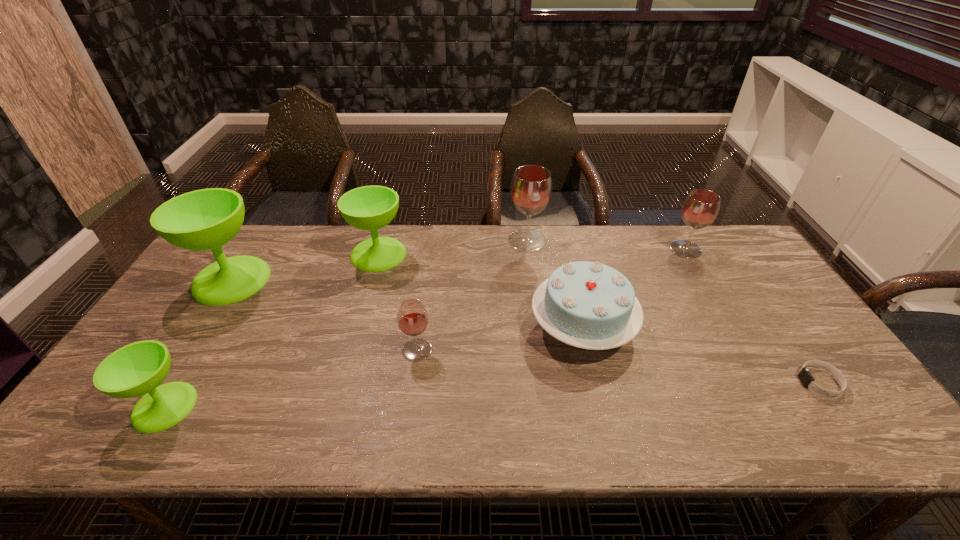
Where is `blank region between the fifth wineglass from left to right and the second smallest green wineglass`? blank region between the fifth wineglass from left to right and the second smallest green wineglass is located at coordinates (453, 247).

The width and height of the screenshot is (960, 540). In order to click on empty location between the birthday cake and the wristband in this screenshot , I will do `click(701, 354)`.

You are a GUI agent. You are given a task and a screenshot of the screen. Output one action in this format:
    pyautogui.click(x=<x>, y=<y>)
    Task: Click on the object that is the sixth closest to the shortest object
    
    Given the screenshot: What is the action you would take?
    pyautogui.click(x=139, y=368)

Locate which object ranks fourth in proximity to the third wineglass from right to left. Please provide its 2D coordinates. Your answer should be formatted as a tuple, i.e. [(x, y)], where the tuple contains the x and y coordinates of a point satisfying the conditions above.

[(139, 368)]

Locate an element on the screen. The width and height of the screenshot is (960, 540). the sixth closest wineglass to the rightmost object is located at coordinates (x=206, y=219).

The height and width of the screenshot is (540, 960). I want to click on wineglass that is the second closest to the nearest green wineglass, so click(x=412, y=317).

I want to click on red wineglass that is the closest to the biggest green wineglass, so click(x=412, y=317).

Locate an element on the screen. Image resolution: width=960 pixels, height=540 pixels. red wineglass identified as the second closest to the fourth object from left to right is located at coordinates (701, 207).

In order to click on green wineglass that stands as the third closest to the shortest object in this screenshot , I will do `click(206, 219)`.

Identify which green wineglass is located as the second nearest to the biggest green wineglass. Please provide its 2D coordinates. Your answer should be formatted as a tuple, i.e. [(x, y)], where the tuple contains the x and y coordinates of a point satisfying the conditions above.

[(139, 368)]